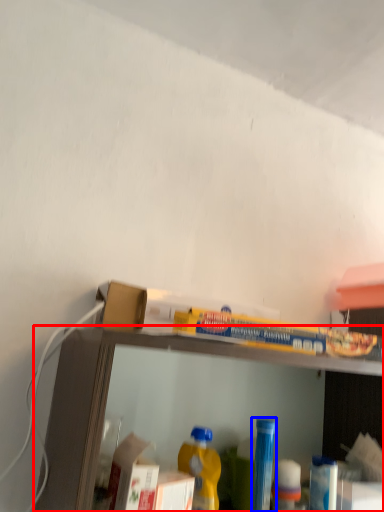
Question: Which object is further to the camera taking this photo, shelf (highlighted by a red box) or bottle (highlighted by a blue box)?

Choices:
 (A) shelf
 (B) bottle

Answer: (B)